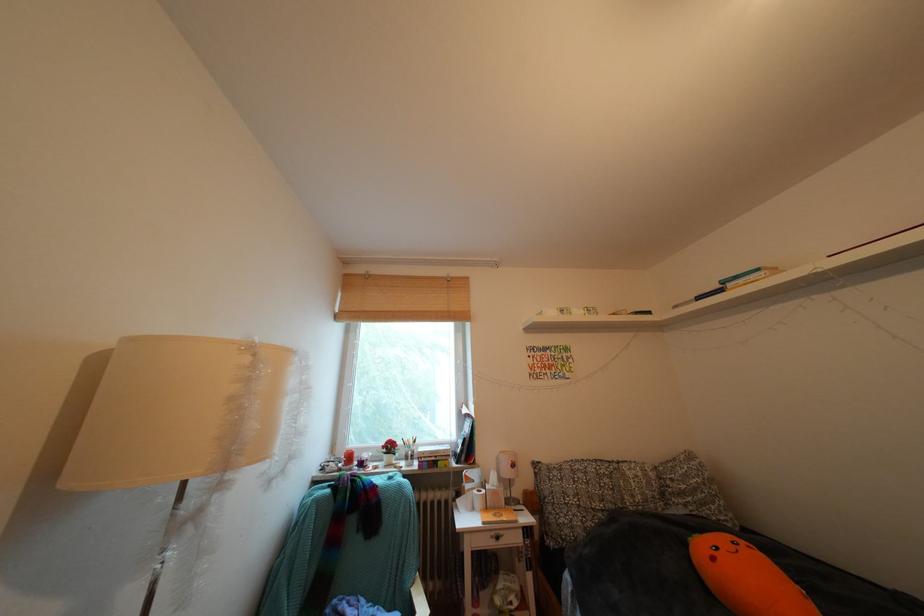
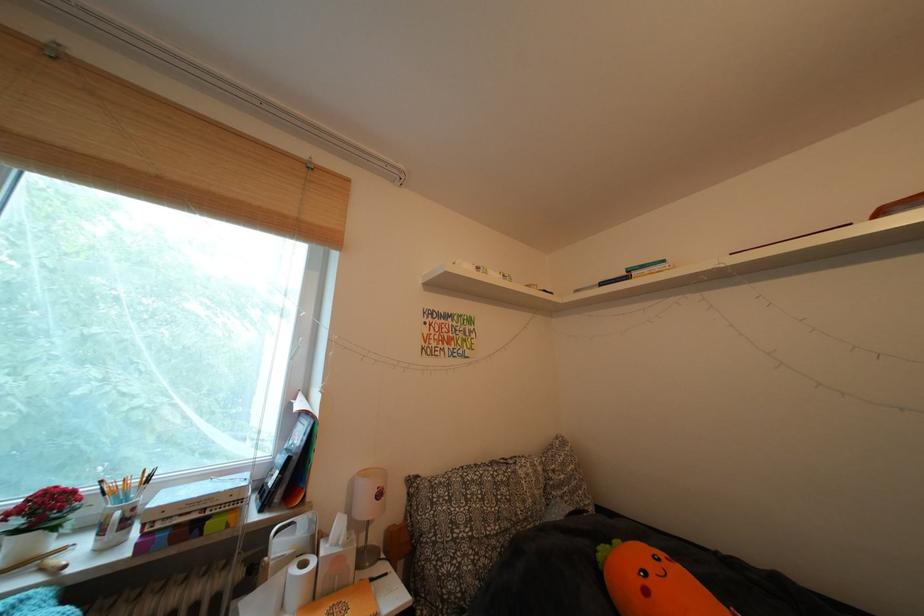
Find the pixel in the second image that matches (489,509) in the first image.

(306, 602)